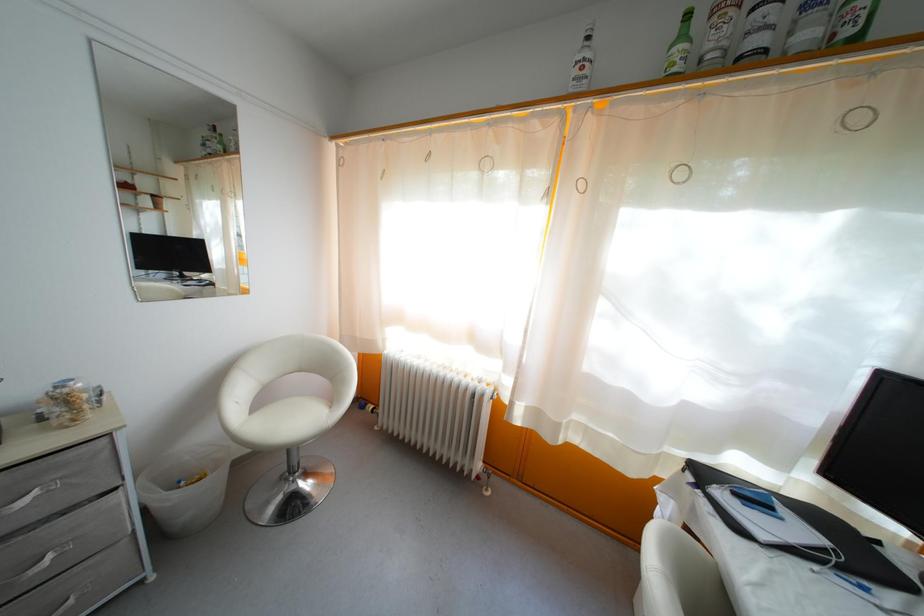
The width and height of the screenshot is (924, 616). I want to click on radiator valve, so click(368, 407).